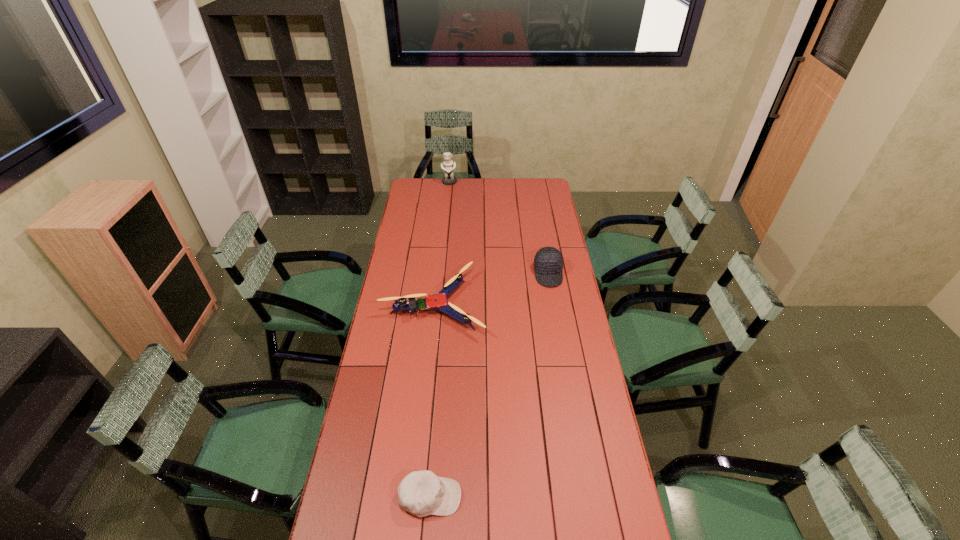
Image resolution: width=960 pixels, height=540 pixels. Find the location of `figurine`. figurine is located at coordinates (448, 166).

Find the location of `the tallest object`. the tallest object is located at coordinates (448, 166).

This screenshot has width=960, height=540. I want to click on the rightmost object, so click(x=548, y=262).

Where is `the taller baseball cap`? the taller baseball cap is located at coordinates (548, 262).

I want to click on drone, so click(438, 301).

Where is `the left baseball cap`? The image size is (960, 540). the left baseball cap is located at coordinates (421, 493).

The height and width of the screenshot is (540, 960). What are the coordinates of `the shorter baseball cap` in the screenshot? It's located at (421, 493).

Image resolution: width=960 pixels, height=540 pixels. Identify the location of free space located on the front-facing side of the farthest object. (445, 224).

The height and width of the screenshot is (540, 960). What are the coordinates of `free space located at the front of the taller baseball cap where the brim is located` in the screenshot? It's located at (553, 302).

This screenshot has height=540, width=960. Find the location of `vacant space located 0.270m on the back of the drone`. vacant space located 0.270m on the back of the drone is located at coordinates (441, 240).